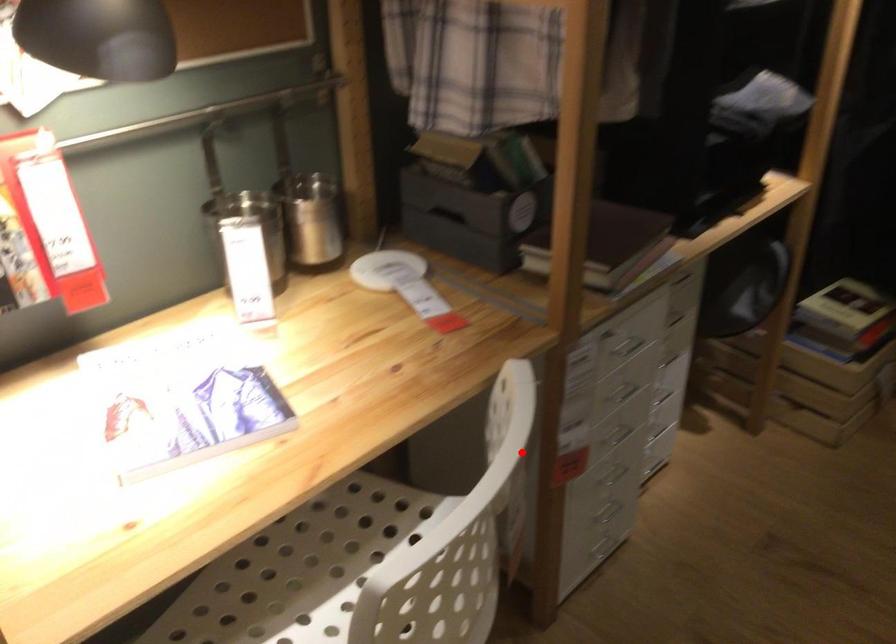
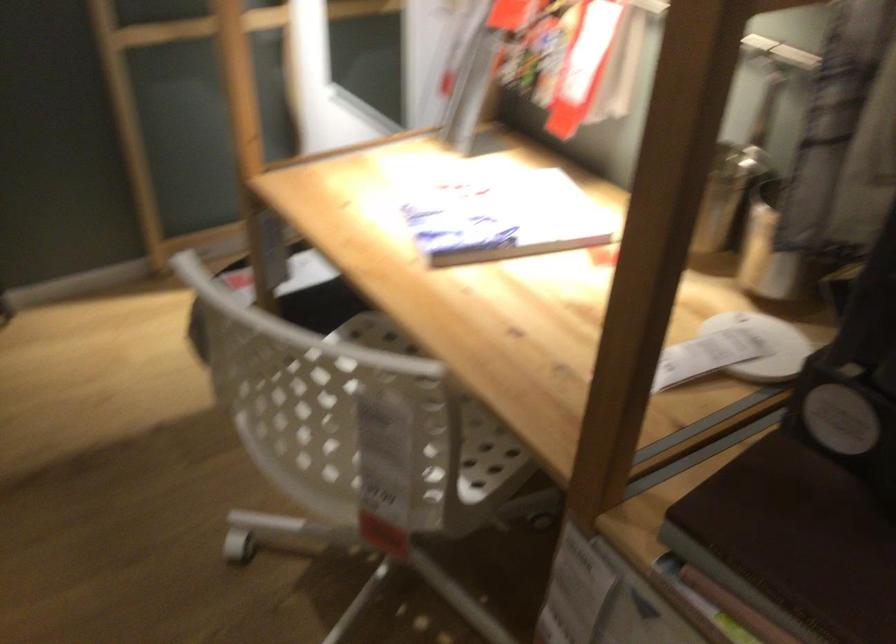
Locate, in the second image, the point that corresponds to the highlighted location in the first image.

(371, 418)